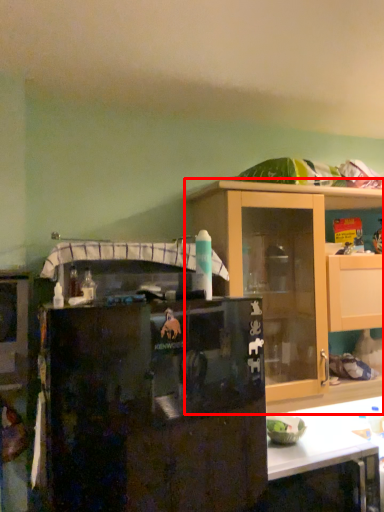
Question: From the image, what is the correct spatial relationship of cabinetry (annotated by the red box) in relation to refrigerator?

Choices:
 (A) right
 (B) left

Answer: (A)